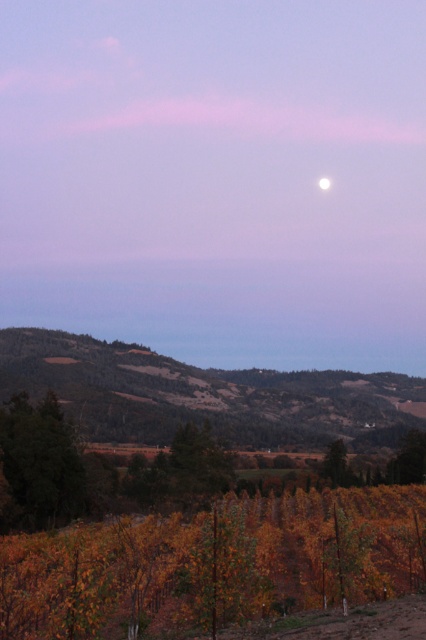
From the picture: You are standing at the center of the image and want to walk towards the green matte tree at lower left. In which direction should you move?

Since the green matte tree at lower left is located at point (37, 465) in the 2D coordinate system, you should move towards the lower left direction to reach it.

In the scene shown: You are standing at the base of the green grassy hillside at lower center. Looking towards the horizon, which direction would you face to see the full moon in the upper right quadrant of the sky?

Since the green grassy hillside at lower center is positioned at point (206, 396), facing towards the upper right direction would align your view with the full moon in the upper right quadrant of the sky.

You are standing at the base of the green grassy hillside at lower center and want to walk towards the green matte tree at lower left. Which direction should you face to move closer to the tree?

You should face towards the lower left direction to move closer to the green matte tree at lower left since it is closer to you than the green grassy hillside at lower center.